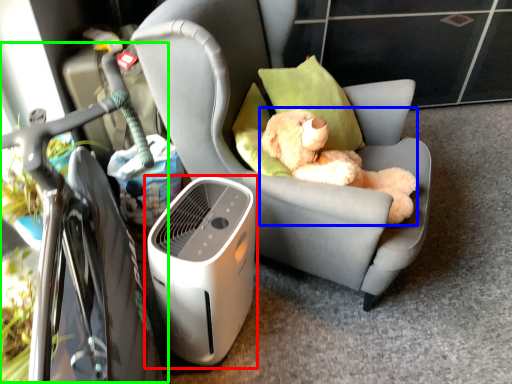
Question: Which object is positioned closest to home appliance (highlighted by a red box)? Select from toy (highlighted by a blue box) and bicycle (highlighted by a green box).

Choices:
 (A) toy
 (B) bicycle

Answer: (B)